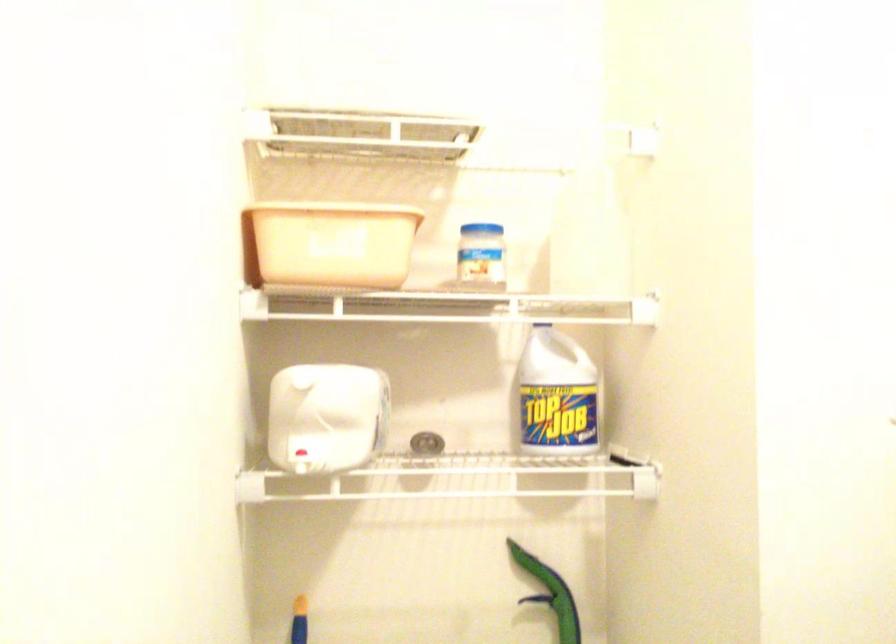
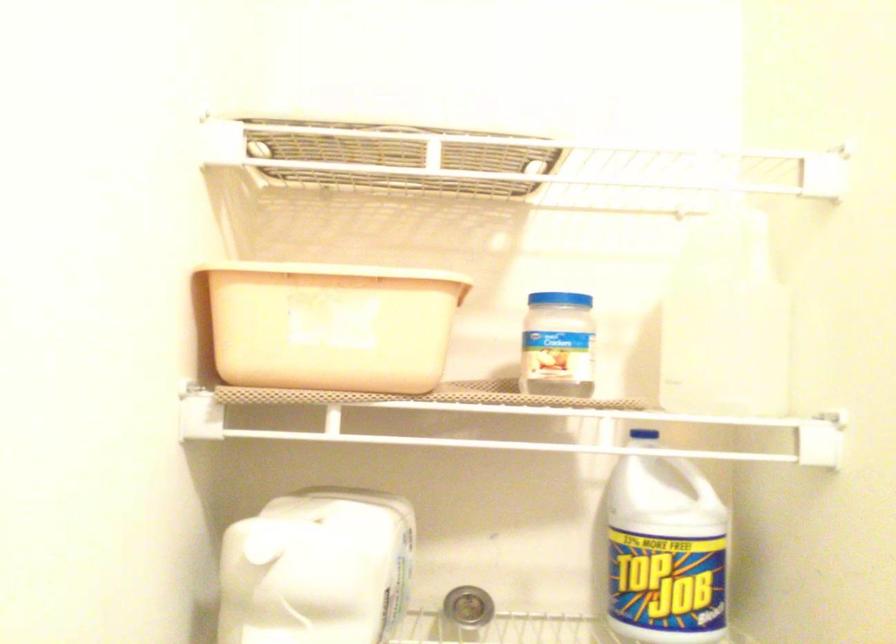
In the second image, find the point that corresponds to pixel 479 254 in the first image.

(558, 342)